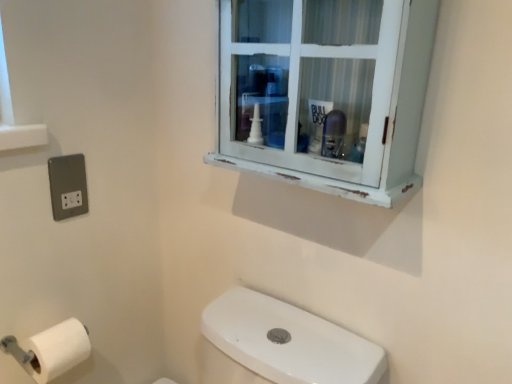
Question: From the image's perspective, would you say white matte toilet paper at lower left is positioned over satin silver socket at lower left?

Choices:
 (A) yes
 (B) no

Answer: (B)

Question: Does white matte toilet paper at lower left have a greater width compared to satin silver socket at lower left?

Choices:
 (A) no
 (B) yes

Answer: (B)

Question: Does white matte toilet paper at lower left appear on the right side of satin silver socket at lower left?

Choices:
 (A) no
 (B) yes

Answer: (A)

Question: Considering the relative sizes of white matte toilet paper at lower left and satin silver socket at lower left in the image provided, is white matte toilet paper at lower left smaller than satin silver socket at lower left?

Choices:
 (A) yes
 (B) no

Answer: (B)

Question: Is white matte toilet paper at lower left completely or partially outside of satin silver socket at lower left?

Choices:
 (A) no
 (B) yes

Answer: (B)

Question: Looking at their shapes, would you say white matte toilet paper at lower left is wider or thinner than white distressed cabinet at upper center?

Choices:
 (A) wide
 (B) thin

Answer: (B)

Question: Considering the positions of white matte toilet paper at lower left and white distressed cabinet at upper center in the image, is white matte toilet paper at lower left taller or shorter than white distressed cabinet at upper center?

Choices:
 (A) short
 (B) tall

Answer: (A)

Question: In the image, is white matte toilet paper at lower left on the left side or the right side of white distressed cabinet at upper center?

Choices:
 (A) left
 (B) right

Answer: (A)

Question: Is point (62, 355) positioned closer to the camera than point (377, 109)?

Choices:
 (A) closer
 (B) farther

Answer: (B)

Question: Is satin silver socket at lower left situated inside white matte toilet paper at lower left or outside?

Choices:
 (A) inside
 (B) outside

Answer: (B)

Question: In terms of height, does satin silver socket at lower left look taller or shorter compared to white matte toilet paper at lower left?

Choices:
 (A) tall
 (B) short

Answer: (A)

Question: Considering the positions of satin silver socket at lower left and white matte toilet paper at lower left in the image, is satin silver socket at lower left bigger or smaller than white matte toilet paper at lower left?

Choices:
 (A) big
 (B) small

Answer: (B)

Question: Looking at their shapes, would you say satin silver socket at lower left is wider or thinner than white matte toilet paper at lower left?

Choices:
 (A) thin
 (B) wide

Answer: (A)

Question: In terms of height, does white distressed cabinet at upper center look taller or shorter compared to white matte toilet paper at lower left?

Choices:
 (A) tall
 (B) short

Answer: (A)

Question: Would you say white distressed cabinet at upper center is to the left or to the right of white matte toilet paper at lower left in the picture?

Choices:
 (A) right
 (B) left

Answer: (A)